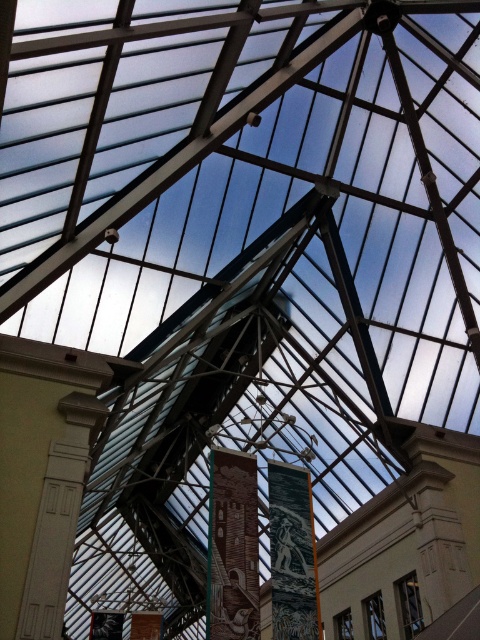
You are standing inside the building looking up at the glass roof. There is a point marked at coordinates (232, 547). What is the location of this point relative to the brick textured pillar at center?

The point (232, 547) is located on the brick textured pillar at center.

You are standing in the building and want to hang a large mirror on the wall. The mirror requires a sturdy support point. Which object between the white carved stone pillar at left and the dark green textured tapestry at center would be the better choice for mounting the mirror?

The white carved stone pillar at left is a better choice for mounting the mirror as it is a structural support, unlike the dark green textured tapestry at center which is a hanging decorative item.